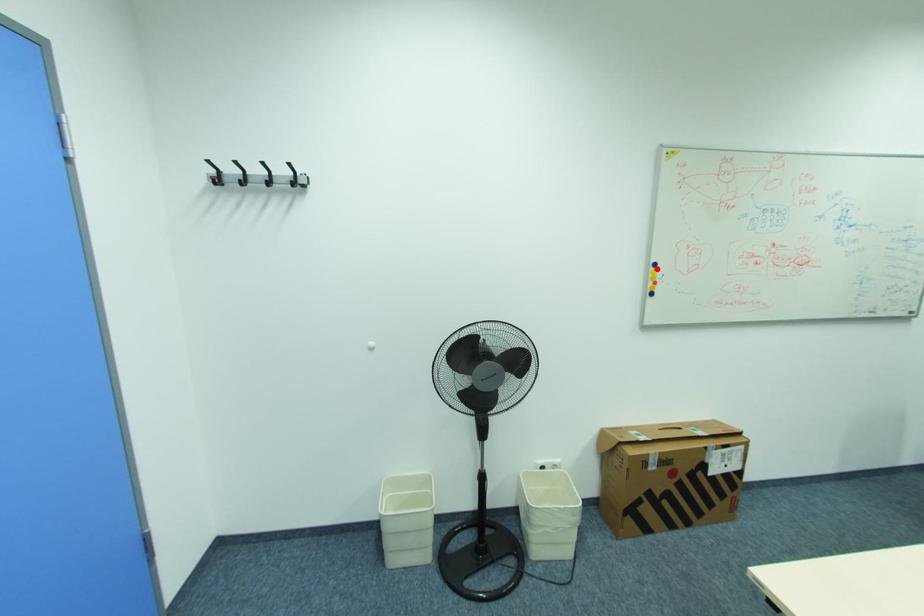
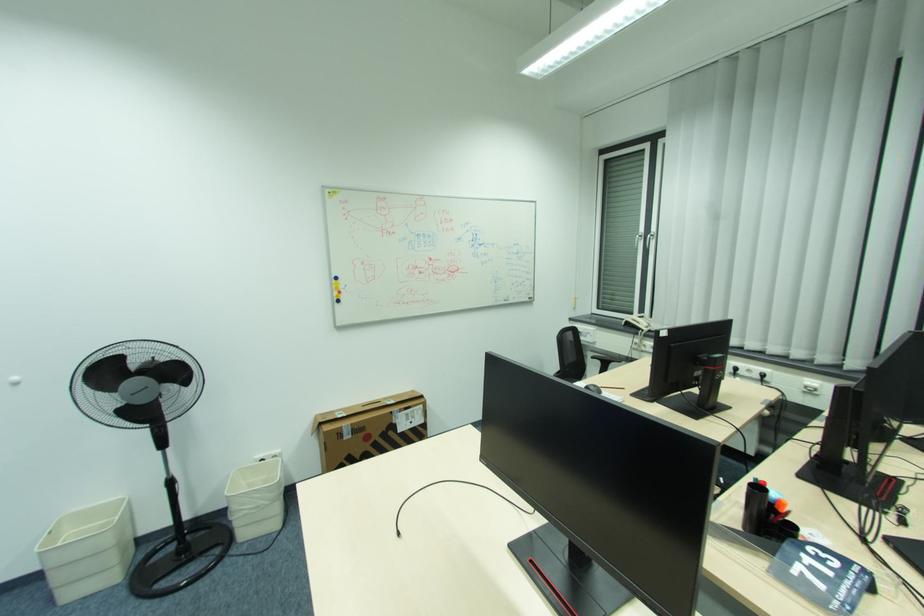
Question: I am providing you with two images of the same scene from different viewpoints. A red point is marked on the first image. Is the red point's position out of view in image 2?

Choices:
 (A) Yes
 (B) No

Answer: (B)